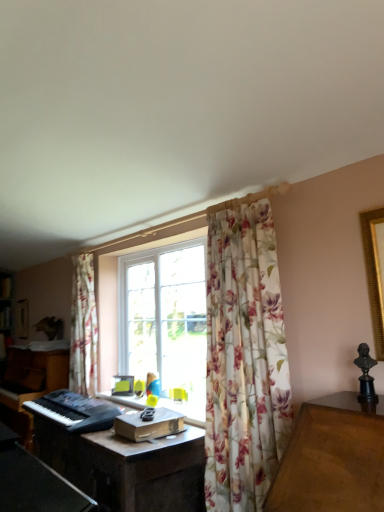
This screenshot has width=384, height=512. In order to click on dark brown wooden computer desk at center in this screenshot , I will do `click(127, 467)`.

Locate an element on the screen. The image size is (384, 512). floral fabric curtain at left is located at coordinates (83, 328).

Where is `dark brown wooden computer desk at center`? dark brown wooden computer desk at center is located at coordinates click(127, 467).

Does black plastic keyboard at lower left have a greater width compared to floral fabric curtain at center?

No.

Is black plastic keyboard at lower left facing towards floral fabric curtain at center?

No, black plastic keyboard at lower left is not facing towards floral fabric curtain at center.

Is black plastic keyboard at lower left not close to floral fabric curtain at center?

No, black plastic keyboard at lower left is not far away from floral fabric curtain at center.

From a real-world perspective, does black plastic keyboard at lower left stand above floral fabric curtain at center?

No, from a real-world perspective, black plastic keyboard at lower left is not on top of floral fabric curtain at center.

Considering the relative sizes of black plastic keyboard at lower left and floral fabric curtain at left in the image provided, is black plastic keyboard at lower left bigger than floral fabric curtain at left?

No, black plastic keyboard at lower left is not bigger than floral fabric curtain at left.

Between black plastic keyboard at lower left and floral fabric curtain at left, which one has larger width?

With larger width is black plastic keyboard at lower left.

Which is more to the right, black plastic keyboard at lower left or floral fabric curtain at left?

From the viewer's perspective, black plastic keyboard at lower left appears more on the right side.

From the image's perspective, is black plastic keyboard at lower left located beneath floral fabric curtain at left?

Yes, from the image's perspective, black plastic keyboard at lower left is below floral fabric curtain at left.

From a real-world perspective, is dark brown wooden computer desk at center below floral fabric curtain at center?

Yes, from a real-world perspective, dark brown wooden computer desk at center is under floral fabric curtain at center.

Which is more to the left, dark brown wooden computer desk at center or floral fabric curtain at center?

dark brown wooden computer desk at center is more to the left.

From the image's perspective, would you say dark brown wooden computer desk at center is shown under floral fabric curtain at center?

Yes, from the image's perspective, dark brown wooden computer desk at center is below floral fabric curtain at center.

Consider the image. Who is more distant, dark brown wooden computer desk at center or black plastic keyboard at lower left?

black plastic keyboard at lower left is more distant.

The image size is (384, 512). What are the coordinates of `musical keyboard behind the dark brown wooden computer desk at center` in the screenshot? It's located at (75, 411).

Considering the relative sizes of dark brown wooden computer desk at center and black plastic keyboard at lower left in the image provided, is dark brown wooden computer desk at center bigger than black plastic keyboard at lower left?

Yes.

Considering the positions of objects dark brown wooden computer desk at center and black plastic keyboard at lower left in the image provided, who is more to the left, dark brown wooden computer desk at center or black plastic keyboard at lower left?

Positioned to the left is black plastic keyboard at lower left.

Based on the photo, is floral fabric curtain at center oriented away from black plastic keyboard at lower left?

No, floral fabric curtain at center's orientation is not away from black plastic keyboard at lower left.

Can you confirm if floral fabric curtain at center is wider than black plastic keyboard at lower left?

Yes.

Does floral fabric curtain at center appear on the left side of black plastic keyboard at lower left?

No, floral fabric curtain at center is not to the left of black plastic keyboard at lower left.

Considering the sizes of objects floral fabric curtain at center and black plastic keyboard at lower left in the image provided, who is taller, floral fabric curtain at center or black plastic keyboard at lower left?

floral fabric curtain at center is taller.

I want to click on musical keyboard below the floral fabric curtain at left (from the image's perspective), so click(75, 411).

Which is less distant, (x=86, y=315) or (x=101, y=403)?

Clearly, point (x=86, y=315) is more distant from the camera than point (x=101, y=403).

Is floral fabric curtain at left not near black plastic keyboard at lower left?

No, floral fabric curtain at left is not far from black plastic keyboard at lower left.

Looking at the image, does floral fabric curtain at left seem bigger or smaller compared to black plastic keyboard at lower left?

Clearly, floral fabric curtain at left is larger in size than black plastic keyboard at lower left.

From their relative heights in the image, would you say floral fabric curtain at center is taller or shorter than floral fabric curtain at left?

floral fabric curtain at center is taller than floral fabric curtain at left.

Between floral fabric curtain at center and floral fabric curtain at left, which one has smaller width?

With smaller width is floral fabric curtain at left.

Which is closer, (275, 384) or (74, 369)?

The point (275, 384) is closer.

Is floral fabric curtain at center oriented away from floral fabric curtain at left?

That's not correct — floral fabric curtain at center is not looking away from floral fabric curtain at left.

At what (x,y) coordinates should I click in order to perform the action: click on window to the right of black plastic keyboard at lower left. Please return your answer as a coordinate pair (x, y). Looking at the image, I should click on (244, 354).

In the image, there is a black plastic keyboard at lower left. Where is `curtain above it (from the image's perspective)`? The height and width of the screenshot is (512, 384). curtain above it (from the image's perspective) is located at coordinates (83, 328).

From the image, which object appears to be nearer to floral fabric curtain at center, black plastic keyboard at lower left or dark brown wooden computer desk at center?

dark brown wooden computer desk at center is closer to floral fabric curtain at center.

In the scene shown: When comparing their distances from floral fabric curtain at center, does dark brown wooden computer desk at center or black plastic keyboard at lower left seem further?

black plastic keyboard at lower left lies further to floral fabric curtain at center than the other object.

Looking at the image, which one is located further to black plastic keyboard at lower left, floral fabric curtain at center or dark brown wooden computer desk at center?

floral fabric curtain at center lies further to black plastic keyboard at lower left than the other object.

From the image, which object appears to be farther from black plastic keyboard at lower left, dark brown wooden computer desk at center or floral fabric curtain at center?

floral fabric curtain at center.

Based on their spatial positions, is floral fabric curtain at center or black plastic keyboard at lower left further from floral fabric curtain at left?

floral fabric curtain at center.

From the image, which object appears to be nearer to floral fabric curtain at left, dark brown wooden computer desk at center or floral fabric curtain at center?

The object closer to floral fabric curtain at left is dark brown wooden computer desk at center.

Considering their positions, is black plastic keyboard at lower left positioned further to dark brown wooden computer desk at center than floral fabric curtain at center?

Among the two, floral fabric curtain at center is located further to dark brown wooden computer desk at center.

Considering their positions, is floral fabric curtain at center positioned further to dark brown wooden computer desk at center than floral fabric curtain at left?

Among the two, floral fabric curtain at left is located further to dark brown wooden computer desk at center.

Identify the location of musical keyboard positioned between floral fabric curtain at center and floral fabric curtain at left from near to far. The height and width of the screenshot is (512, 384). (75, 411).

Locate an element on the screen. The image size is (384, 512). computer desk between black plastic keyboard at lower left and floral fabric curtain at center from left to right is located at coordinates (127, 467).

In order to click on computer desk between floral fabric curtain at center and floral fabric curtain at left along the z-axis in this screenshot , I will do `click(127, 467)`.

Identify the location of musical keyboard between dark brown wooden computer desk at center and floral fabric curtain at left along the z-axis. (75, 411).